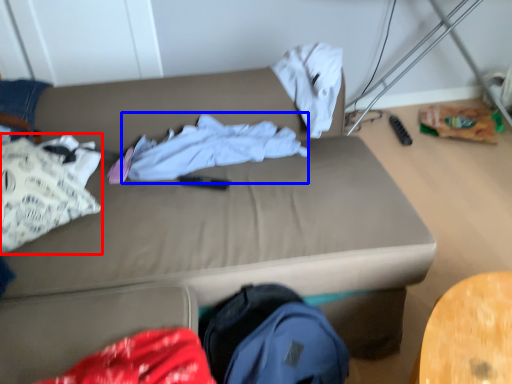
Question: Among these objects, which one is nearest to the camera, clothing (highlighted by a red box) or clothing (highlighted by a blue box)?

Choices:
 (A) clothing
 (B) clothing

Answer: (A)